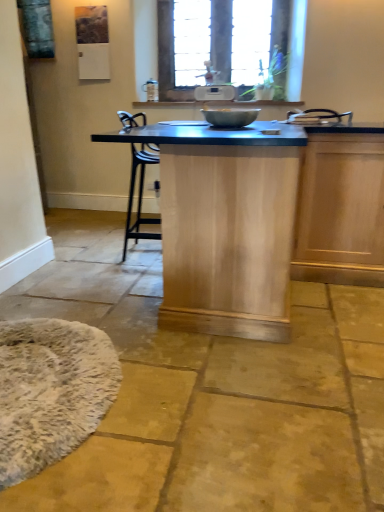
Question: From a real-world perspective, is natural wood table at center above or below white fluffy mat at lower left?

Choices:
 (A) above
 (B) below

Answer: (A)

Question: Considering the positions of natural wood table at center and white fluffy mat at lower left in the image, is natural wood table at center bigger or smaller than white fluffy mat at lower left?

Choices:
 (A) big
 (B) small

Answer: (A)

Question: Estimate the real-world distances between objects in this image. Which object is closer to the wooden frame at upper center?

Choices:
 (A) natural wood table at center
 (B) white fluffy mat at lower left
 (C) metallic silver mixing bowl at center

Answer: (C)

Question: Which is nearer to the wooden frame at upper center?

Choices:
 (A) natural wood table at center
 (B) white fluffy mat at lower left
 (C) metallic silver mixing bowl at center

Answer: (C)